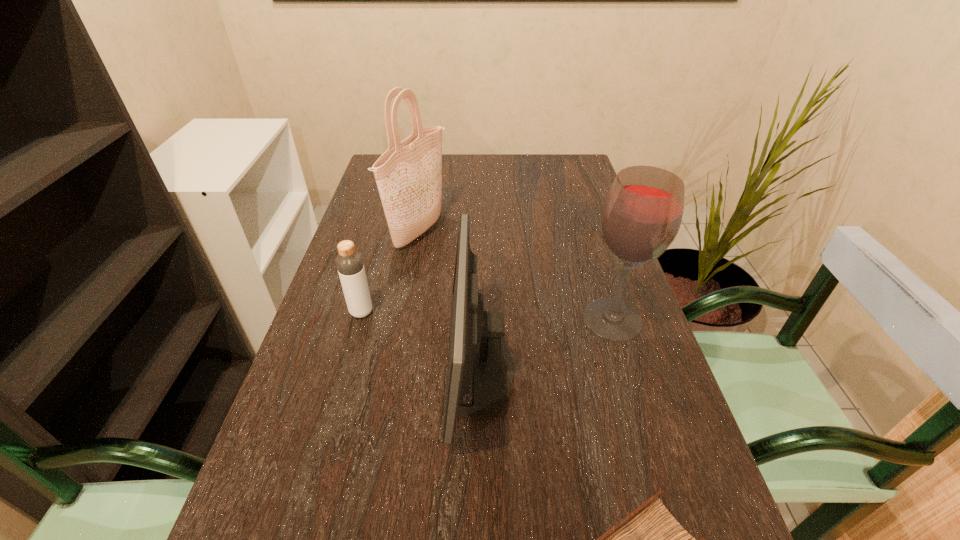
The image size is (960, 540). I want to click on shopping bag positioned at the left edge, so click(409, 174).

At what (x,y) coordinates should I click in order to perform the action: click on bottle at the left edge. Please return your answer as a coordinate pair (x, y). Image resolution: width=960 pixels, height=540 pixels. Looking at the image, I should click on (349, 262).

At what (x,y) coordinates should I click in order to perform the action: click on object that is positioned at the right edge. Please return your answer as a coordinate pair (x, y). The width and height of the screenshot is (960, 540). Looking at the image, I should click on (641, 215).

At what (x,y) coordinates should I click in order to perform the action: click on vacant space at the far edge of the desktop. Please return your answer as a coordinate pair (x, y). The width and height of the screenshot is (960, 540). Looking at the image, I should click on (463, 177).

In the image, there is a desktop. Where is `vacant area at the left edge`? The image size is (960, 540). vacant area at the left edge is located at coordinates (305, 450).

Find the location of a particular element. Image resolution: width=960 pixels, height=540 pixels. free space at the right edge of the desktop is located at coordinates (628, 403).

Where is `free area in between the alcohol and the farthest object`? The height and width of the screenshot is (540, 960). free area in between the alcohol and the farthest object is located at coordinates (516, 275).

Image resolution: width=960 pixels, height=540 pixels. I want to click on unoccupied position between the bottle and the shopping bag, so click(x=390, y=272).

Identify the location of vacant space that is in between the computer monitor and the rightmost object. The image size is (960, 540). (547, 345).

Locate an element on the screen. free space between the shortest object and the computer monitor is located at coordinates (421, 341).